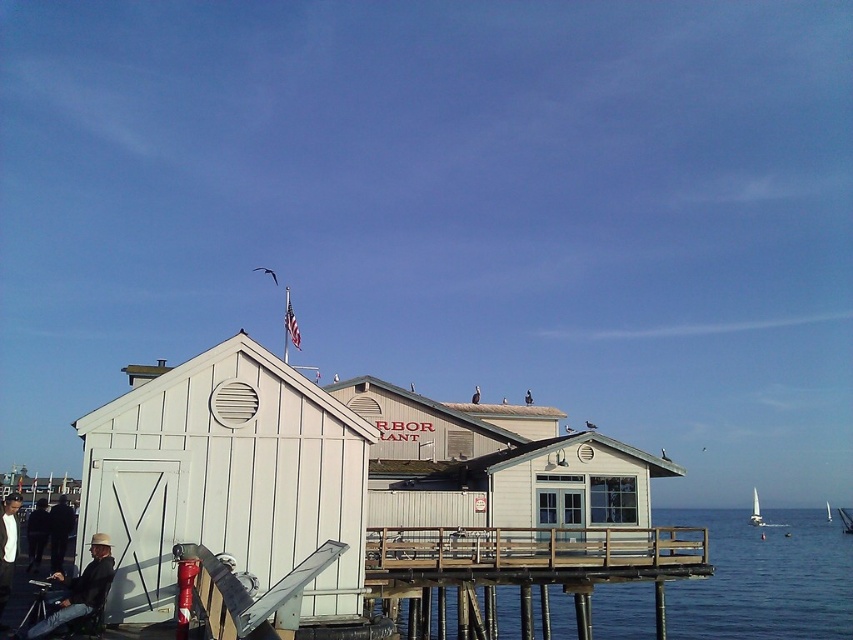
Is white leather jacket at lower left shorter than dark gray jacket at lower left?

No.

Is white leather jacket at lower left thinner than dark gray jacket at lower left?

In fact, white leather jacket at lower left might be wider than dark gray jacket at lower left.

The width and height of the screenshot is (853, 640). Find the location of `white leather jacket at lower left`. white leather jacket at lower left is located at coordinates (7, 545).

I want to click on white leather jacket at lower left, so click(x=7, y=545).

Does denim jacket at lower left come in front of dark gray jacket at lower left?

That is True.

Does point (113, 572) come farther from viewer compared to point (35, 512)?

No, (113, 572) is closer to viewer.

Find the location of `denim jacket at lower left`. denim jacket at lower left is located at coordinates (79, 589).

Does transparent blue water at lower center have a larger size compared to dark gray jacket at lower left?

Indeed, transparent blue water at lower center has a larger size compared to dark gray jacket at lower left.

What do you see at coordinates (764, 579) in the screenshot?
I see `transparent blue water at lower center` at bounding box center [764, 579].

Who is more forward, (726, 584) or (38, 564)?

Positioned in front is point (38, 564).

Where is `transparent blue water at lower center`? Image resolution: width=853 pixels, height=640 pixels. transparent blue water at lower center is located at coordinates (764, 579).